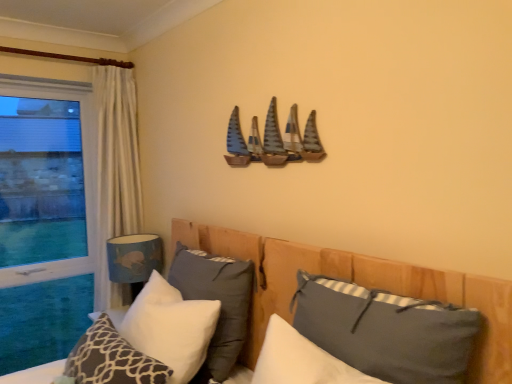
Question: Can you confirm if transparent glass window at left is taller than wooden bed at center?

Choices:
 (A) no
 (B) yes

Answer: (B)

Question: Is transparent glass window at left closer to the viewer compared to wooden bed at center?

Choices:
 (A) no
 (B) yes

Answer: (A)

Question: From the image's perspective, does transparent glass window at left appear higher than wooden bed at center?

Choices:
 (A) no
 (B) yes

Answer: (B)

Question: Considering the relative sizes of transparent glass window at left and wooden bed at center in the image provided, is transparent glass window at left smaller than wooden bed at center?

Choices:
 (A) yes
 (B) no

Answer: (A)

Question: Can you confirm if transparent glass window at left is wider than wooden bed at center?

Choices:
 (A) yes
 (B) no

Answer: (B)

Question: Considering the relative sizes of transparent glass window at left and wooden bed at center in the image provided, is transparent glass window at left bigger than wooden bed at center?

Choices:
 (A) yes
 (B) no

Answer: (B)

Question: Considering the relative positions of blue fabric lampshade at lower left and wooden sailboats at upper center in the image provided, is blue fabric lampshade at lower left to the right of wooden sailboats at upper center from the viewer's perspective?

Choices:
 (A) yes
 (B) no

Answer: (B)

Question: Is blue fabric lampshade at lower left closer to the viewer compared to wooden sailboats at upper center?

Choices:
 (A) yes
 (B) no

Answer: (B)

Question: Is blue fabric lampshade at lower left shorter than wooden sailboats at upper center?

Choices:
 (A) no
 (B) yes

Answer: (A)

Question: From the image's perspective, would you say blue fabric lampshade at lower left is shown under wooden sailboats at upper center?

Choices:
 (A) no
 (B) yes

Answer: (B)

Question: From the image's perspective, is blue fabric lampshade at lower left over wooden sailboats at upper center?

Choices:
 (A) no
 (B) yes

Answer: (A)

Question: From a real-world perspective, is blue fabric lampshade at lower left below wooden sailboats at upper center?

Choices:
 (A) yes
 (B) no

Answer: (A)

Question: Is white soft pillow at center, which is counted as the third pillow, starting from the right, located within wooden bed at center?

Choices:
 (A) no
 (B) yes

Answer: (B)